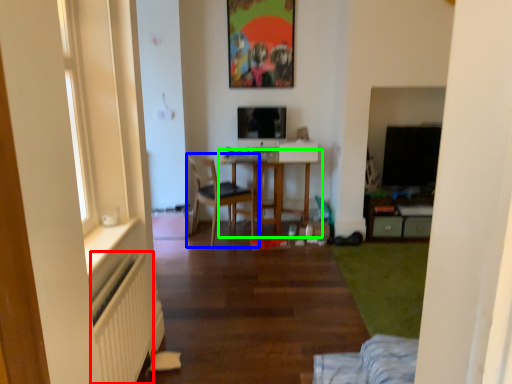
Question: Which object is positioned farthest from radiator (highlighted by a red box)? Select from chair (highlighted by a blue box) and table (highlighted by a green box).

Choices:
 (A) chair
 (B) table

Answer: (B)